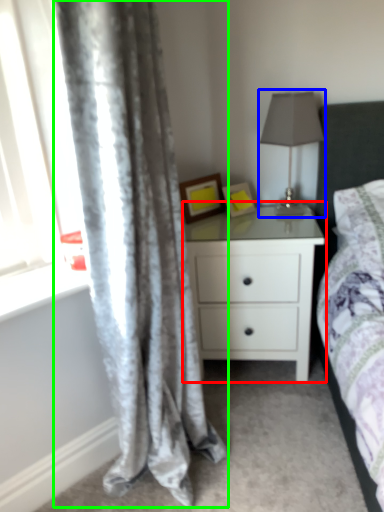
Question: Considering the real-world distances, which object is farthest from nightstand (highlighted by a red box)? table lamp (highlighted by a blue box) or curtain (highlighted by a green box)?

Choices:
 (A) table lamp
 (B) curtain

Answer: (B)